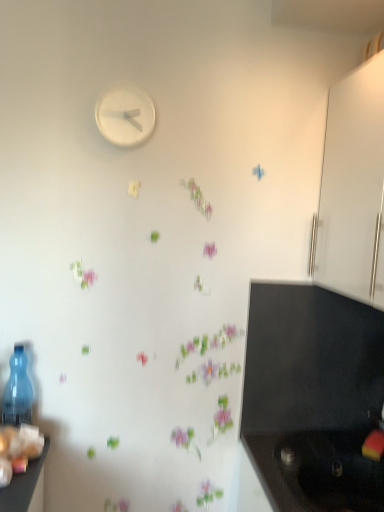
Question: In the image, is white matte clock at upper center positioned in front of or behind black matte sink at lower right?

Choices:
 (A) front
 (B) behind

Answer: (B)

Question: From the image's perspective, is white matte clock at upper center above or below black matte sink at lower right?

Choices:
 (A) above
 (B) below

Answer: (A)

Question: Estimate the real-world distances between objects in this image. Which object is closer to the transparent plastic bottle at left?

Choices:
 (A) black matte sink at lower right
 (B) white glossy cabinet at right
 (C) white matte clock at upper center

Answer: (C)

Question: Based on their relative distances, which object is farther from the white matte clock at upper center?

Choices:
 (A) transparent plastic bottle at left
 (B) white glossy cabinet at right
 (C) black matte sink at lower right

Answer: (C)